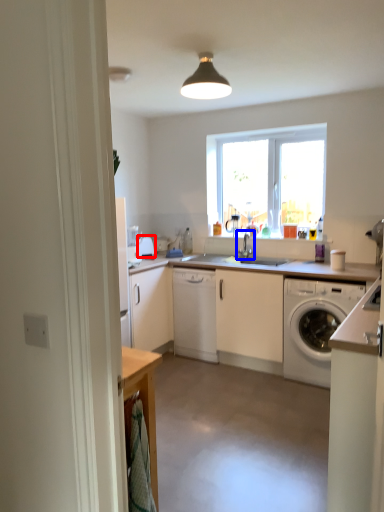
Question: Which object is closer to the camera taking this photo, appliance (highlighted by a red box) or tap (highlighted by a blue box)?

Choices:
 (A) appliance
 (B) tap

Answer: (B)